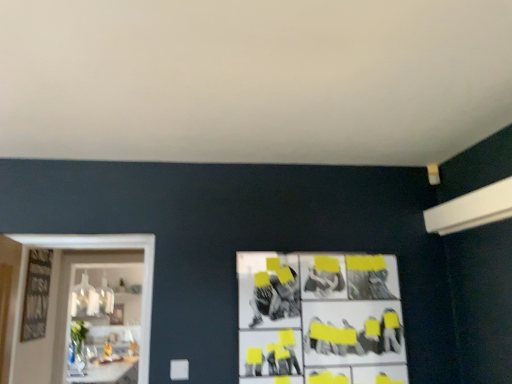
Question: Considering the relative positions of white glossy table at lower left and black and white collage at center in the image provided, is white glossy table at lower left to the right of black and white collage at center from the viewer's perspective?

Choices:
 (A) no
 (B) yes

Answer: (A)

Question: From a real-world perspective, is white glossy table at lower left over black and white collage at center?

Choices:
 (A) yes
 (B) no

Answer: (B)

Question: Does white glossy table at lower left have a lesser height compared to black and white collage at center?

Choices:
 (A) no
 (B) yes

Answer: (B)

Question: Does white glossy table at lower left have a larger size compared to black and white collage at center?

Choices:
 (A) no
 (B) yes

Answer: (B)

Question: Is the position of white glossy table at lower left less distant than that of black and white collage at center?

Choices:
 (A) yes
 (B) no

Answer: (B)

Question: Can you confirm if white glossy table at lower left is smaller than black and white collage at center?

Choices:
 (A) no
 (B) yes

Answer: (A)

Question: Is white glossy shelf at left behind white glossy table at lower left?

Choices:
 (A) yes
 (B) no

Answer: (B)

Question: Is white glossy shelf at left at the left side of white glossy table at lower left?

Choices:
 (A) no
 (B) yes

Answer: (A)

Question: Is white glossy shelf at left not close to white glossy table at lower left?

Choices:
 (A) yes
 (B) no

Answer: (B)

Question: Can you confirm if white glossy shelf at left is taller than white glossy table at lower left?

Choices:
 (A) yes
 (B) no

Answer: (A)

Question: From a real-world perspective, does white glossy shelf at left stand above white glossy table at lower left?

Choices:
 (A) no
 (B) yes

Answer: (B)

Question: Is white glossy table at lower left surrounded by white glossy shelf at left?

Choices:
 (A) yes
 (B) no

Answer: (B)

Question: From a real-world perspective, is white glossy shelf at left on top of black and white collage at center?

Choices:
 (A) no
 (B) yes

Answer: (A)